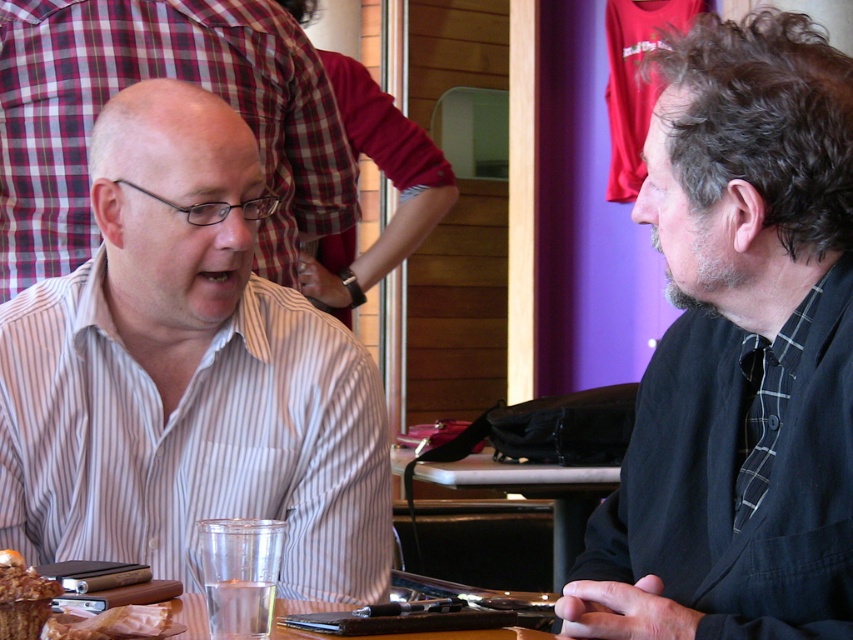
Is striped cotton shirt at left shorter than dark gray flannel shirt at right?

Incorrect, striped cotton shirt at left's height does not fall short of dark gray flannel shirt at right's.

Is striped cotton shirt at left to the right of dark gray flannel shirt at right from the viewer's perspective?

Incorrect, striped cotton shirt at left is not on the right side of dark gray flannel shirt at right.

Does point (271, 476) come in front of point (627, 605)?

No, (271, 476) is further to viewer.

The width and height of the screenshot is (853, 640). I want to click on striped cotton shirt at left, so click(187, 374).

Is the position of dark gray flannel shirt at right more distant than that of wooden table at center?

No, it is not.

Is dark gray flannel shirt at right wider than wooden table at center?

No, dark gray flannel shirt at right is not wider than wooden table at center.

What do you see at coordinates (738, 353) in the screenshot? This screenshot has width=853, height=640. I see `dark gray flannel shirt at right` at bounding box center [738, 353].

Find the location of a particular element. The image size is (853, 640). dark gray flannel shirt at right is located at coordinates (738, 353).

Does chocolate cake at lower left appear under golden brown bread at lower left?

Incorrect, chocolate cake at lower left is not positioned below golden brown bread at lower left.

Where is `chocolate cake at lower left`? This screenshot has height=640, width=853. chocolate cake at lower left is located at coordinates (22, 596).